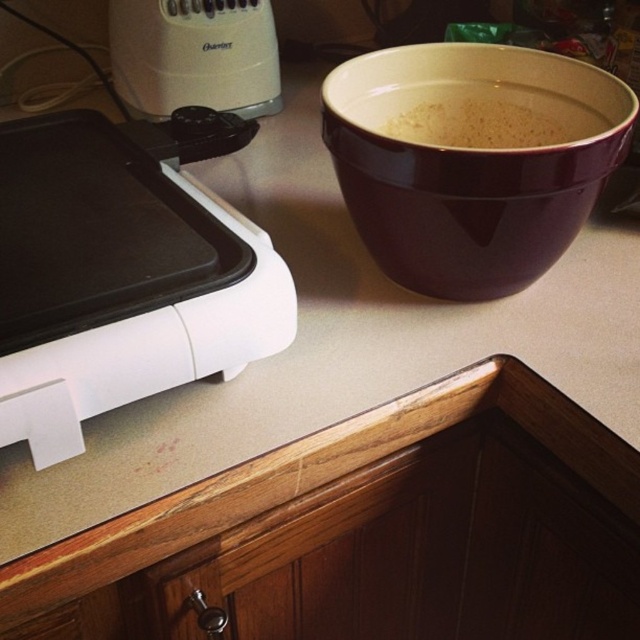
Does white plastic blender at upper left lie in front of white matte powder at upper center?

No, white plastic blender at upper left is behind white matte powder at upper center.

Does white plastic blender at upper left have a greater height compared to white matte powder at upper center?

Yes, white plastic blender at upper left is taller than white matte powder at upper center.

Find the location of a particular element. This screenshot has height=640, width=640. white plastic blender at upper left is located at coordinates (195, 54).

Is white glossy electric griddle at left to the left of white plastic blender at upper left from the viewer's perspective?

Indeed, white glossy electric griddle at left is positioned on the left side of white plastic blender at upper left.

Is point (10, 269) less distant than point (266, 70)?

Yes, it is in front of point (266, 70).

This screenshot has height=640, width=640. I want to click on white glossy electric griddle at left, so click(x=116, y=280).

Between white glossy electric griddle at left and white matte powder at upper center, which one has less height?

With less height is white matte powder at upper center.

Find the location of a particular element. white glossy electric griddle at left is located at coordinates (116, 280).